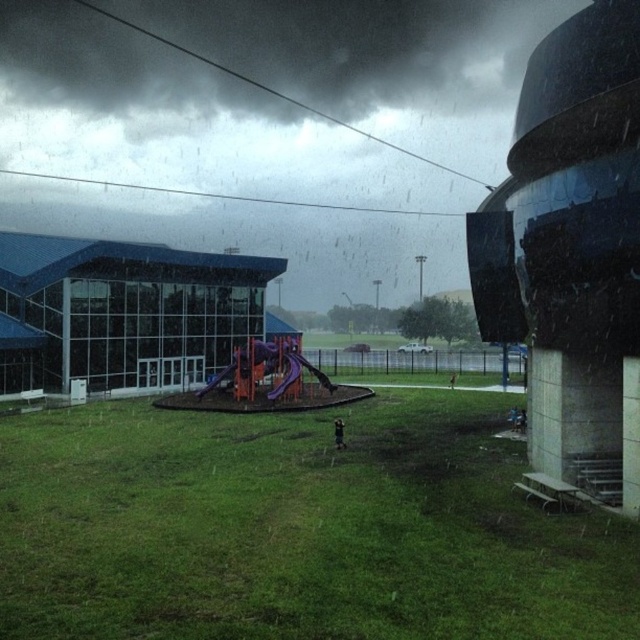
You are standing at the edge of the green grassy field at center and want to reach the purple matte slide at center. Which direction should you move to get there?

The green grassy field at center is to the right of the purple matte slide at center, so you should move to the left to reach it.

From the picture: You are standing at the edge of the image and want to walk towards the purple plastic slide at center. Which direction should you move relative to the green grassy field at center?

You should move to the left relative to the green grassy field at center because the green grassy field at center is to the right of the purple plastic slide at center, meaning the slide is to the left of the field.

You are a photographer trying to capture a wide shot of the entire scene. Given that the green grassy field at center and the purple plastic slide at center are both in your frame, which object will occupy more of the photo?

The green grassy field at center is larger in size than the purple plastic slide at center, so it will occupy more of the photo.